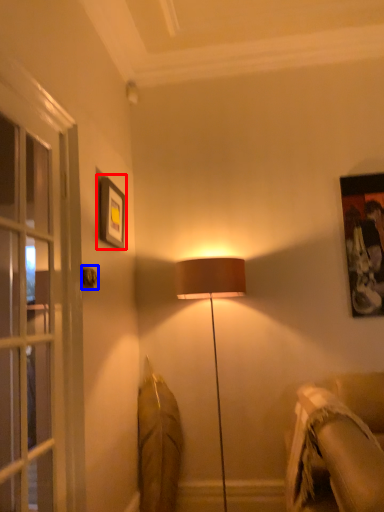
Question: Which of the following is the farthest to the observer, picture frame (highlighted by a red box) or door handle (highlighted by a blue box)?

Choices:
 (A) picture frame
 (B) door handle

Answer: (A)